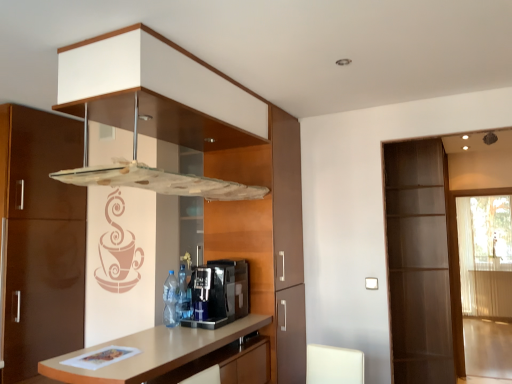
At what (x,y) coordinates should I click in order to perform the action: click on free spot in front of black plastic coffee machine at center. Please return your answer as a coordinate pair (x, y). The height and width of the screenshot is (384, 512). Looking at the image, I should click on (180, 339).